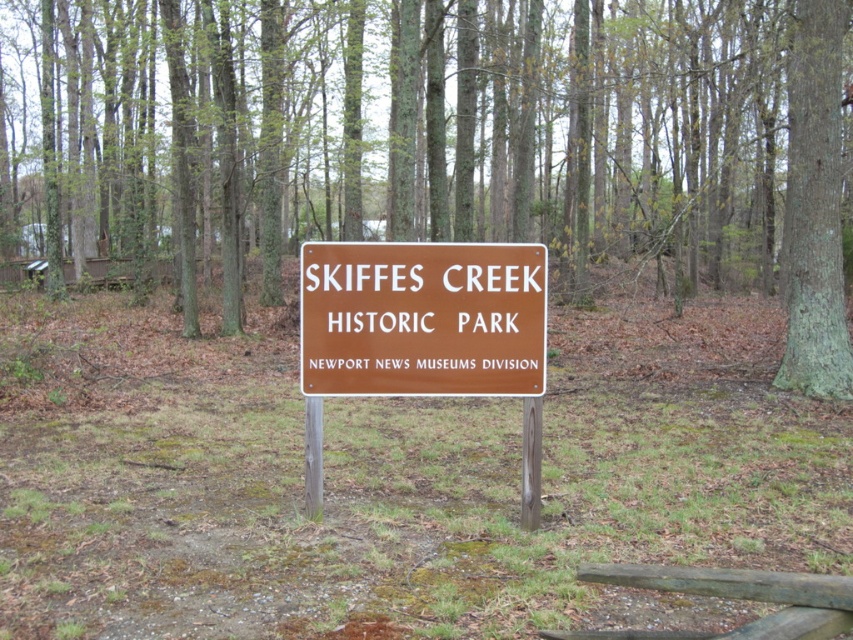
You are standing at the point marked as point [439,144]. What object are you touching?

The point [439,144] is on green bark tree at center, so you are touching the green bark tree at center.